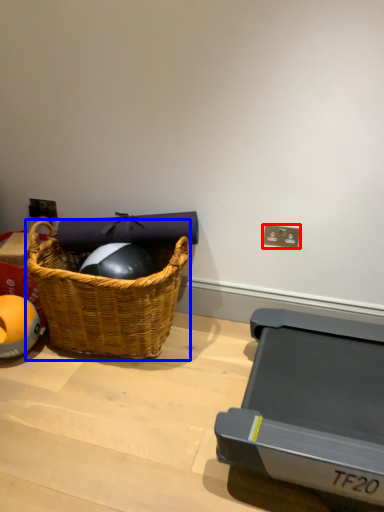
Question: Which object appears farthest to the camera in this image, electric outlet (highlighted by a red box) or picnic basket (highlighted by a blue box)?

Choices:
 (A) electric outlet
 (B) picnic basket

Answer: (A)